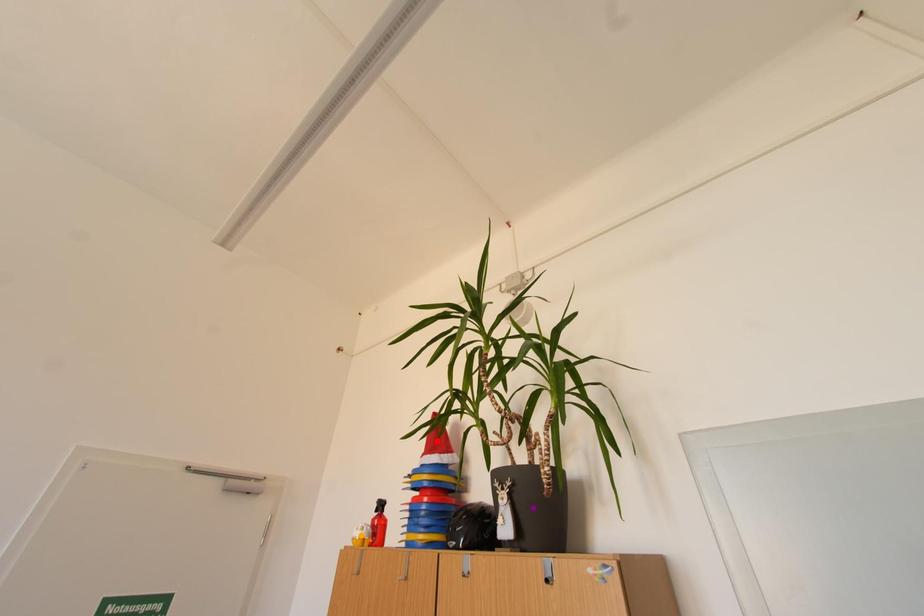
Order these from nearest to farthest:
A) purple point
B) orange point
C) red point

purple point, orange point, red point